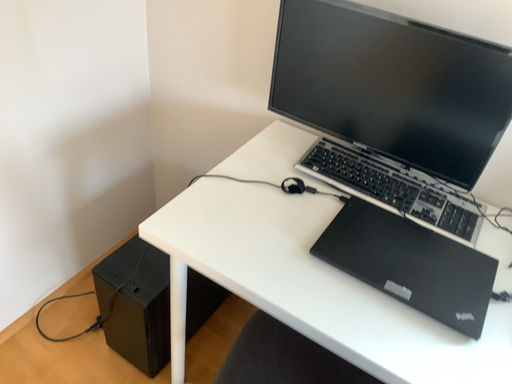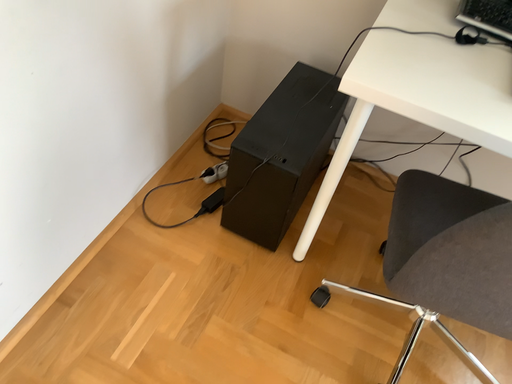
Question: Which way did the camera rotate in the video?

Choices:
 (A) rotated upward
 (B) rotated downward

Answer: (B)